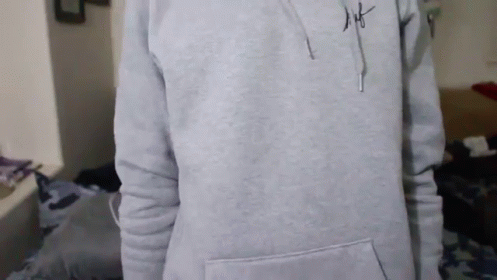
Where is `corner of wall cutout towards the left`? The height and width of the screenshot is (280, 497). corner of wall cutout towards the left is located at coordinates (61, 165).